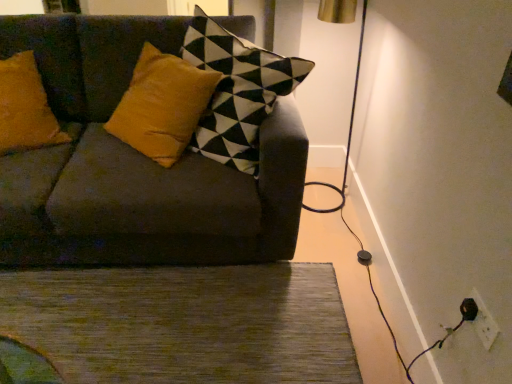
You are a GUI agent. You are given a task and a screenshot of the screen. Output one action in this format:
    pyautogui.click(x=<x>, y=<y>)
    Task: Click on the green textured rug at lower center
    Image resolution: width=512 pixels, height=384 pixels.
    Given the screenshot: What is the action you would take?
    (x=184, y=324)

Looking at this image, what is the approximate width of white plastic electric outlet at lower right?

white plastic electric outlet at lower right is 1.00 centimeters wide.

Where is `green textured rug at lower center`? Image resolution: width=512 pixels, height=384 pixels. green textured rug at lower center is located at coordinates (184, 324).

Considering the sizes of objects green textured rug at lower center and velvet dark gray couch at center in the image provided, who is taller, green textured rug at lower center or velvet dark gray couch at center?

With more height is velvet dark gray couch at center.

How many degrees apart are the facing directions of green textured rug at lower center and velvet dark gray couch at center?

They differ by 91.4 degrees in their facing directions.

Between point (260, 267) and point (241, 189), which one is positioned behind?

Positioned behind is point (260, 267).

Is green textured rug at lower center positioned with its back to velvet dark gray couch at center?

No, velvet dark gray couch at center is not at the back of green textured rug at lower center.

In the image, is velvet dark gray couch at center on the left side or the right side of white plastic electric outlet at lower right?

In the image, velvet dark gray couch at center appears on the left side of white plastic electric outlet at lower right.

Does velvet dark gray couch at center lie in front of white plastic electric outlet at lower right?

No, it is not.

Between velvet dark gray couch at center and white plastic electric outlet at lower right, which one has larger size?

velvet dark gray couch at center is bigger.

Between velvet dark gray couch at center and white plastic electric outlet at lower right, which one has more height?

Standing taller between the two is velvet dark gray couch at center.

Is velvet dark gray couch at center surrounding green textured rug at lower center?

No, velvet dark gray couch at center does not contain green textured rug at lower center.

Considering the relative positions of velvet dark gray couch at center and green textured rug at lower center in the image provided, is velvet dark gray couch at center behind green textured rug at lower center?

No, velvet dark gray couch at center is in front of green textured rug at lower center.

Is velvet dark gray couch at center aimed at green textured rug at lower center?

Yes, velvet dark gray couch at center faces towards green textured rug at lower center.

Does point (118, 240) lie in front of point (266, 355)?

No.

Between white plastic electric outlet at lower right and green textured rug at lower center, which one has larger width?

Wider between the two is green textured rug at lower center.

Is white plastic electric outlet at lower right not within green textured rug at lower center?

Indeed, white plastic electric outlet at lower right is completely outside green textured rug at lower center.

Is the position of white plastic electric outlet at lower right less distant than that of green textured rug at lower center?

Yes, it is in front of green textured rug at lower center.

What's the angular difference between white plastic electric outlet at lower right and green textured rug at lower center's facing directions?

0.053 degrees.

Is velvet dark gray couch at center at the back of white plastic electric outlet at lower right?

That's not correct — white plastic electric outlet at lower right is not looking away from velvet dark gray couch at center.

From the image's perspective, would you say white plastic electric outlet at lower right is shown under velvet dark gray couch at center?

Yes.

Between point (478, 307) and point (132, 207), which one is positioned behind?

The point (132, 207) is farther.

From a real-world perspective, is white plastic electric outlet at lower right under velvet dark gray couch at center?

Yes, from a real-world perspective, white plastic electric outlet at lower right is under velvet dark gray couch at center.

From the image's perspective, who appears lower, green textured rug at lower center or white plastic electric outlet at lower right?

From the image's view, green textured rug at lower center is below.

Is green textured rug at lower center closer to the viewer compared to white plastic electric outlet at lower right?

No, green textured rug at lower center is further to the viewer.

Is there a large distance between green textured rug at lower center and white plastic electric outlet at lower right?

green textured rug at lower center is positioned a significant distance from white plastic electric outlet at lower right.

You are a GUI agent. You are given a task and a screenshot of the screen. Output one action in this format:
    pyautogui.click(x=<x>, y=<y>)
    Task: Click on the studio couch above the green textured rug at lower center (from a real-world perspective)
    Image resolution: width=512 pixels, height=384 pixels.
    Given the screenshot: What is the action you would take?
    pyautogui.click(x=135, y=165)

The width and height of the screenshot is (512, 384). Find the location of `electric outlet beneath the velvet dark gray couch at center (from a real-world perspective)`. electric outlet beneath the velvet dark gray couch at center (from a real-world perspective) is located at coordinates (483, 321).

From the image, which object appears to be nearer to green textured rug at lower center, white plastic electric outlet at lower right or velvet dark gray couch at center?

velvet dark gray couch at center is positioned closer to the anchor green textured rug at lower center.

Estimate the real-world distances between objects in this image. Which object is further from velvet dark gray couch at center, white plastic electric outlet at lower right or green textured rug at lower center?

white plastic electric outlet at lower right is positioned further to the anchor velvet dark gray couch at center.

Looking at the image, which one is located further to velvet dark gray couch at center, green textured rug at lower center or white plastic electric outlet at lower right?

white plastic electric outlet at lower right.

When comparing their distances from green textured rug at lower center, does velvet dark gray couch at center or white plastic electric outlet at lower right seem further?

The object further to green textured rug at lower center is white plastic electric outlet at lower right.

Based on the photo, when comparing their distances from white plastic electric outlet at lower right, does velvet dark gray couch at center or green textured rug at lower center seem closer?

green textured rug at lower center is closer to white plastic electric outlet at lower right.

Based on their spatial positions, is green textured rug at lower center or velvet dark gray couch at center closer to white plastic electric outlet at lower right?

green textured rug at lower center lies closer to white plastic electric outlet at lower right than the other object.

I want to click on doormat between velvet dark gray couch at center and white plastic electric outlet at lower right, so click(184, 324).